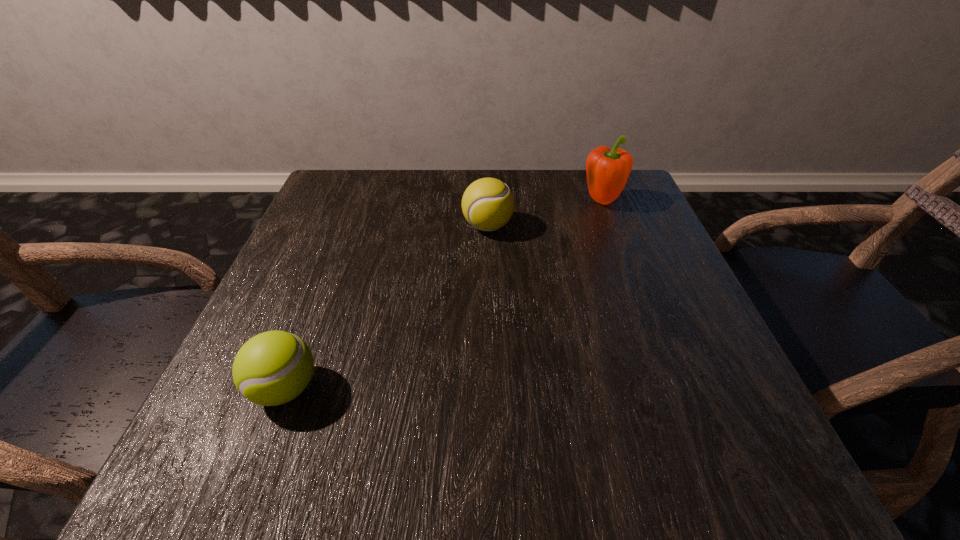
Image resolution: width=960 pixels, height=540 pixels. I want to click on pepper, so click(x=607, y=170).

The image size is (960, 540). I want to click on the rightmost object, so click(x=607, y=170).

Identify the location of the farther tennis ball. This screenshot has height=540, width=960. (487, 204).

Identify the location of the second object from right to left. (487, 204).

Find the location of a particular element. The width and height of the screenshot is (960, 540). the nearer tennis ball is located at coordinates (272, 368).

Where is `the leftmost object`? This screenshot has height=540, width=960. the leftmost object is located at coordinates (272, 368).

Find the location of a particular element. The image size is (960, 540). vacant space situated 0.330m on the front of the pepper is located at coordinates (646, 318).

Where is `vacant space located 0.190m on the front of the second object from left to right`? This screenshot has width=960, height=540. vacant space located 0.190m on the front of the second object from left to right is located at coordinates (490, 306).

Where is `free location located 0.280m on the right of the nearer tennis ball`? The width and height of the screenshot is (960, 540). free location located 0.280m on the right of the nearer tennis ball is located at coordinates (505, 389).

I want to click on pepper located at the far edge, so click(607, 170).